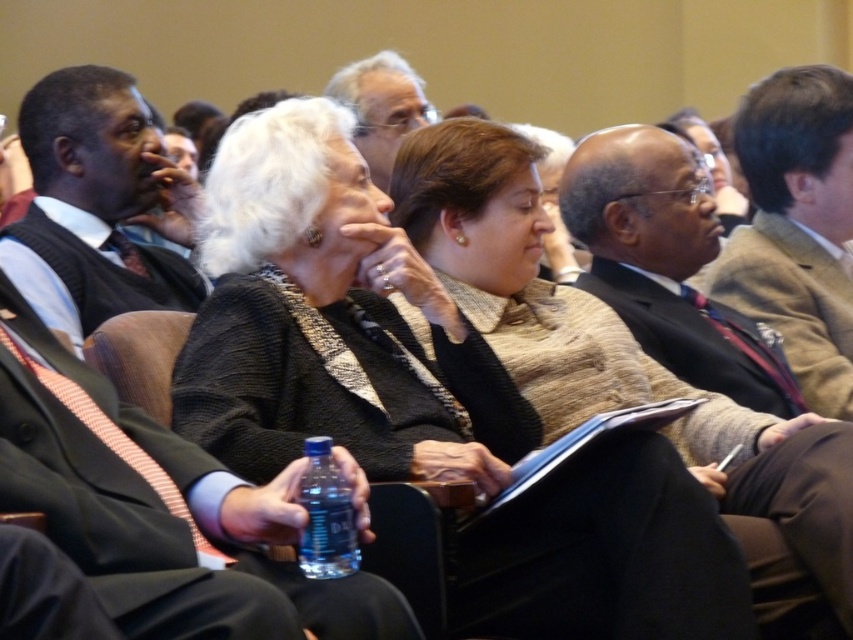
Can you confirm if black wool sweater at center is shorter than matte gray hair at upper center?

Indeed, black wool sweater at center has a lesser height compared to matte gray hair at upper center.

Which is behind, point (277, 369) or point (379, 129)?

The point (379, 129) is more distant.

Find the location of `black wool sweater at center`. black wool sweater at center is located at coordinates (329, 321).

Is matte gray hair at upper center to the left of blue plastic bottle at center from the viewer's perspective?

Indeed, matte gray hair at upper center is positioned on the left side of blue plastic bottle at center.

Who is more distant from viewer, (399, 61) or (318, 524)?

Point (399, 61)

Find the location of `matte gray hair at upper center`. matte gray hair at upper center is located at coordinates (381, 108).

Does point (631, 150) come closer to viewer compared to point (386, 179)?

Yes.

Which is below, black suit at center or matte gray hair at upper center?

Positioned lower is black suit at center.

Measure the distance between point [679,144] and camera.

Point [679,144] and camera are 11.78 meters apart from each other.

At what (x,y) coordinates should I click in order to perform the action: click on black suit at center. Please return your answer as a coordinate pair (x, y). Looking at the image, I should click on (639, 204).